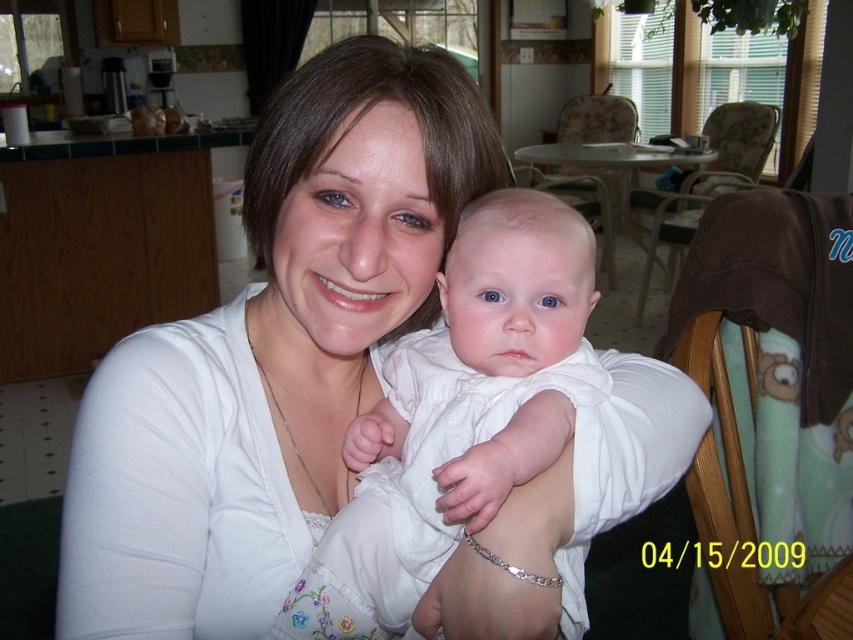
You are standing 20 inches away from the point at the center of the image. Can you reach the point at coordinates point [552,396] without moving your position?

The distance of point [552,396] from viewer is 21.46 inches, so you are currently 20 inches away from the center point. Since the point at coordinates point [552,396] is 1.46 inches further away than the center point, you cannot reach it without moving closer.

You are a photographer setting up for a family photo. You want to ensure the brown fleece blanket at right and the wooden chair at center are both visible in the frame. Based on their positions, which object is closer to the camera?

The brown fleece blanket at right is in front of the wooden chair at center, so it is closer to the camera.

You are a photographer setting up a shoot in this room. You need to place a tripod on the floor. The tripod requires a stable surface. Considering the brown fleece blanket at right and the wooden chair at center, which object should you place the tripod on?

The wooden chair at center is a stable surface, so you should place the tripod on the wooden chair at center instead of the brown fleece blanket at right, which is below it and likely not sturdy enough.